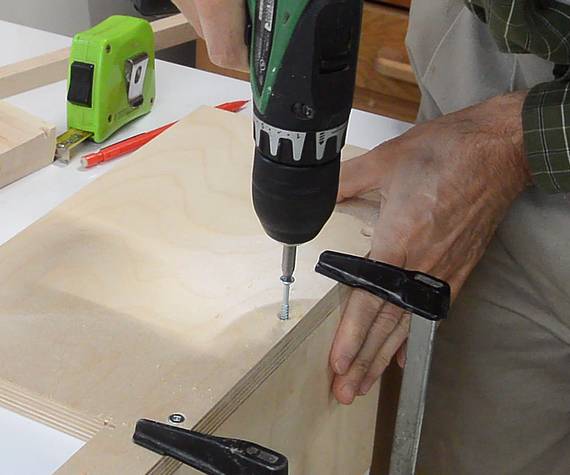
Locate an element on the screen. This screenshot has width=570, height=475. silver screw is located at coordinates (285, 304).